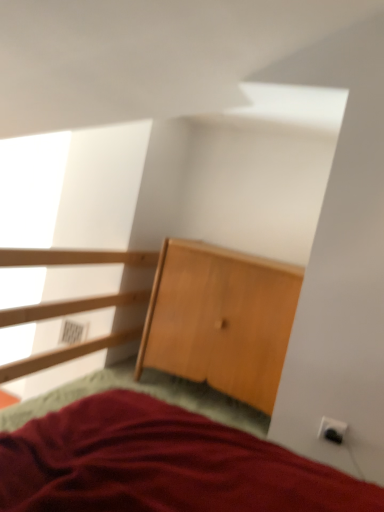
Question: Does light brown wooden dresser at center come behind transparent glass window at upper left?

Choices:
 (A) yes
 (B) no

Answer: (A)

Question: From a real-world perspective, is light brown wooden dresser at center physically below transparent glass window at upper left?

Choices:
 (A) yes
 (B) no

Answer: (A)

Question: Is light brown wooden dresser at center taller than transparent glass window at upper left?

Choices:
 (A) yes
 (B) no

Answer: (B)

Question: Is light brown wooden dresser at center facing away from transparent glass window at upper left?

Choices:
 (A) no
 (B) yes

Answer: (A)

Question: Does light brown wooden dresser at center touch transparent glass window at upper left?

Choices:
 (A) yes
 (B) no

Answer: (B)

Question: From the image's perspective, is white plastic electric outlet at lower right, which is the 1th electric outlet in left-to-right order, positioned above or below transparent glass window at upper left?

Choices:
 (A) below
 (B) above

Answer: (A)

Question: From a real-world perspective, is white plastic electric outlet at lower right, the 2th electric outlet in the right-to-left sequence, physically located above or below transparent glass window at upper left?

Choices:
 (A) above
 (B) below

Answer: (B)

Question: Looking at the image, does white plastic electric outlet at lower right, the first electric outlet positioned from the top, seem bigger or smaller compared to transparent glass window at upper left?

Choices:
 (A) big
 (B) small

Answer: (B)

Question: Considering the positions of white plastic electric outlet at lower right, the 2th electric outlet in the right-to-left sequence, and transparent glass window at upper left in the image, is white plastic electric outlet at lower right, the 2th electric outlet in the right-to-left sequence, taller or shorter than transparent glass window at upper left?

Choices:
 (A) short
 (B) tall

Answer: (A)

Question: Considering the positions of transparent glass window at upper left and white plastic electric outlet at lower right, the first electric outlet positioned from the top, in the image, is transparent glass window at upper left wider or thinner than white plastic electric outlet at lower right, the first electric outlet positioned from the top,?

Choices:
 (A) wide
 (B) thin

Answer: (A)

Question: Considering the positions of transparent glass window at upper left and white plastic electric outlet at lower right, marked as the 1th electric outlet in a back-to-front arrangement, in the image, is transparent glass window at upper left taller or shorter than white plastic electric outlet at lower right, marked as the 1th electric outlet in a back-to-front arrangement,?

Choices:
 (A) short
 (B) tall

Answer: (B)

Question: Considering the positions of point pos(92,178) and point pos(59,343), is point pos(92,178) closer or farther from the camera than point pos(59,343)?

Choices:
 (A) farther
 (B) closer

Answer: (B)

Question: From a real-world perspective, is transparent glass window at upper left above or below white plastic electric outlet at lower right, which is the 1th electric outlet in left-to-right order?

Choices:
 (A) above
 (B) below

Answer: (A)

Question: Is light brown wooden dresser at center bigger or smaller than white plastic electric outlet at lower right, the first electric outlet when ordered from front to back?

Choices:
 (A) small
 (B) big

Answer: (B)

Question: From the image's perspective, relative to white plastic electric outlet at lower right, which is counted as the second electric outlet, starting from the left, is light brown wooden dresser at center above or below?

Choices:
 (A) below
 (B) above

Answer: (B)